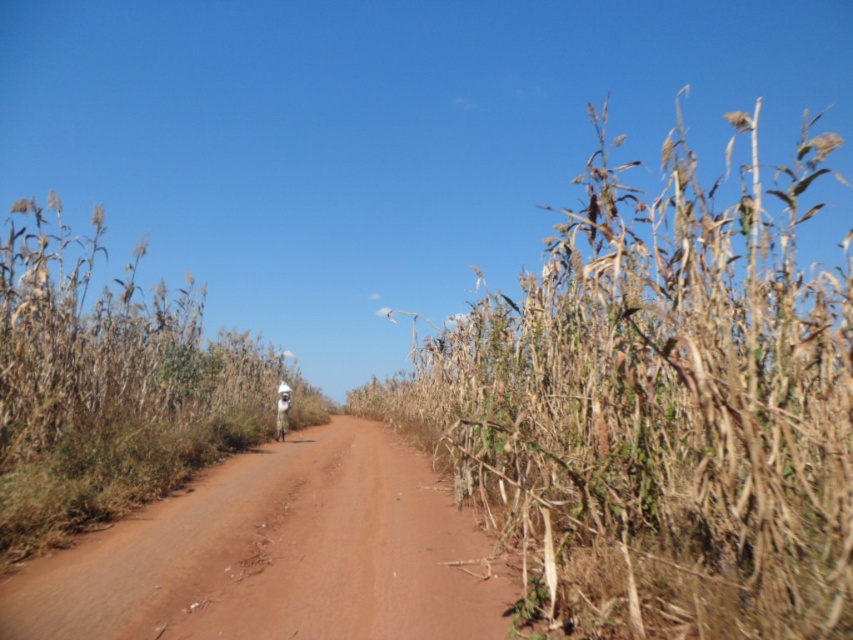
Between brown dirt track at center and brown dry stalks of corn at center, which one appears on the right side from the viewer's perspective?

brown dirt track at center

Is brown dirt track at center thinner than brown dry stalks of corn at center?

Indeed, brown dirt track at center has a lesser width compared to brown dry stalks of corn at center.

Where is `brown dirt track at center`? brown dirt track at center is located at coordinates (277, 554).

Which is below, brown dry stalks of corn at right or brown dirt track at center?

Positioned lower is brown dirt track at center.

Who is more forward, (656, 477) or (347, 508)?

Point (656, 477) is more forward.

Between point (624, 321) and point (444, 486), which one is positioned in front?

Point (624, 321)

What are the coordinates of `brown dry stalks of corn at right` in the screenshot? It's located at (657, 412).

Which is behind, point (518, 378) or point (74, 528)?

Positioned behind is point (518, 378).

The width and height of the screenshot is (853, 640). I want to click on brown dry stalks of corn at right, so click(657, 412).

Find the location of a particular element. Image resolution: width=853 pixels, height=640 pixels. brown dry stalks of corn at right is located at coordinates (657, 412).